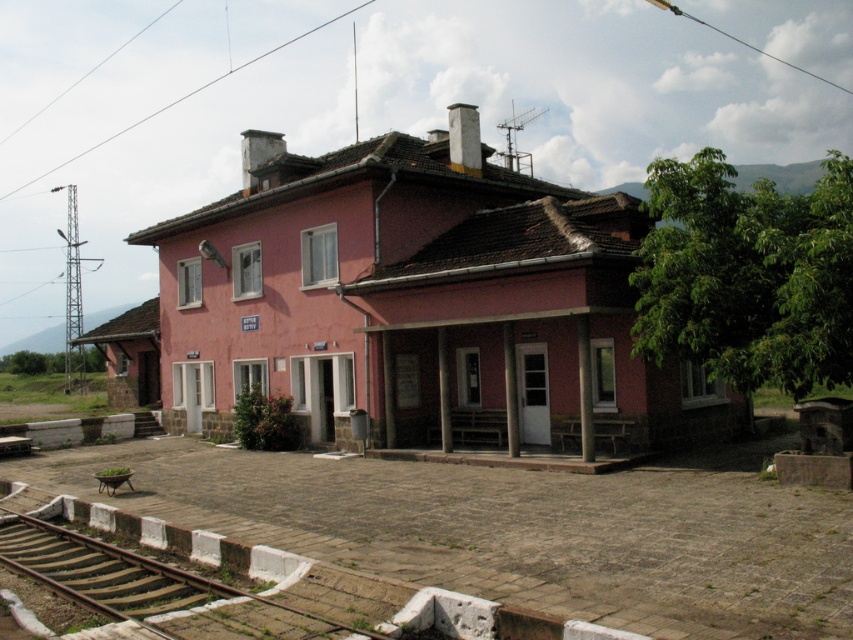
Question: Does pink brick building at center have a greater width compared to brown wooden train track at lower left?

Choices:
 (A) yes
 (B) no

Answer: (A)

Question: Among these points, which one is nearest to the camera?

Choices:
 (A) (76, 545)
 (B) (413, 324)

Answer: (A)

Question: Does pink brick building at center appear on the left side of brown wooden train track at lower left?

Choices:
 (A) yes
 (B) no

Answer: (B)

Question: Which point is closer to the camera?

Choices:
 (A) (575, 259)
 (B) (80, 548)

Answer: (B)

Question: Can you confirm if pink brick building at center is smaller than brown wooden train track at lower left?

Choices:
 (A) no
 (B) yes

Answer: (A)